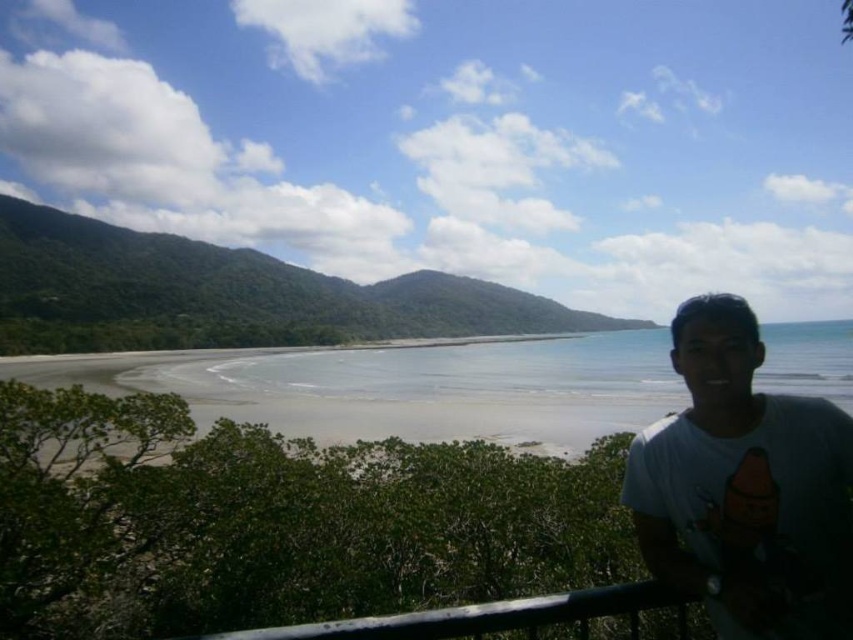
Question: Which point is closer to the camera?

Choices:
 (A) (589, 593)
 (B) (714, 324)

Answer: (A)

Question: Is white cotton t-shirt at right to the left of black metal rail at lower right from the viewer's perspective?

Choices:
 (A) no
 (B) yes

Answer: (A)

Question: Can you confirm if white cotton t-shirt at right is positioned below black metal rail at lower right?

Choices:
 (A) no
 (B) yes

Answer: (A)

Question: Is white cotton t-shirt at right below black metal rail at lower right?

Choices:
 (A) no
 (B) yes

Answer: (A)